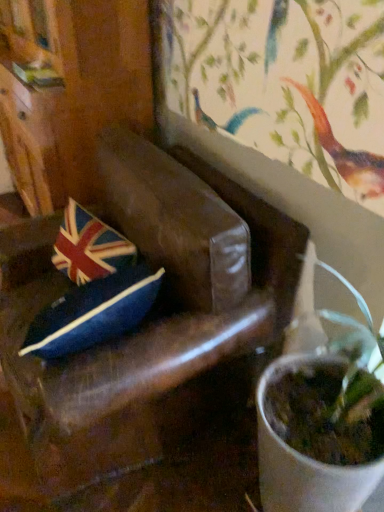
Question: Is brown leather chair at center thinner than velvet union jack pillow at center?

Choices:
 (A) no
 (B) yes

Answer: (A)

Question: Does brown leather chair at center touch velvet union jack pillow at center?

Choices:
 (A) no
 (B) yes

Answer: (A)

Question: Can you confirm if brown leather chair at center is wider than velvet union jack pillow at center?

Choices:
 (A) no
 (B) yes

Answer: (B)

Question: Is brown leather chair at center further to camera compared to velvet union jack pillow at center?

Choices:
 (A) no
 (B) yes

Answer: (A)

Question: Is brown leather chair at center oriented away from velvet union jack pillow at center?

Choices:
 (A) no
 (B) yes

Answer: (B)

Question: Does brown leather chair at center turn towards velvet union jack pillow at center?

Choices:
 (A) yes
 (B) no

Answer: (A)

Question: Is velvet union jack pillow at center located outside brown leather chair at center?

Choices:
 (A) yes
 (B) no

Answer: (B)

Question: Can you confirm if velvet union jack pillow at center is wider than brown leather chair at center?

Choices:
 (A) no
 (B) yes

Answer: (A)

Question: Is brown leather chair at center a part of velvet union jack pillow at center?

Choices:
 (A) yes
 (B) no

Answer: (B)

Question: Is velvet union jack pillow at center further to camera compared to brown leather chair at center?

Choices:
 (A) yes
 (B) no

Answer: (A)

Question: Is velvet union jack pillow at center turned away from brown leather chair at center?

Choices:
 (A) yes
 (B) no

Answer: (A)

Question: Does velvet union jack pillow at center appear on the right side of brown leather chair at center?

Choices:
 (A) no
 (B) yes

Answer: (A)

Question: Considering the positions of point (87, 214) and point (299, 266), is point (87, 214) closer or farther from the camera than point (299, 266)?

Choices:
 (A) farther
 (B) closer

Answer: (A)